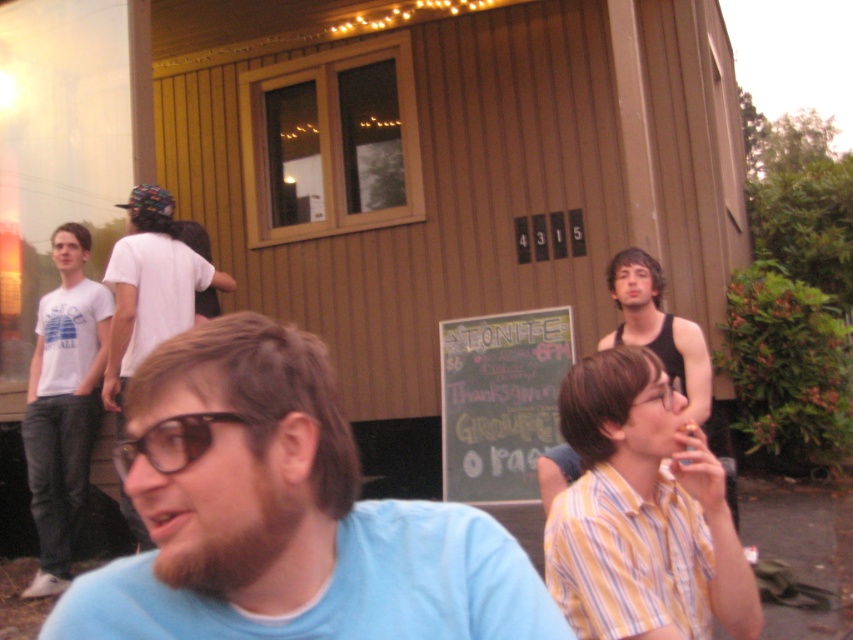
Question: Can you confirm if white matte t-shirt at left is wider than white t-shirt at left?

Choices:
 (A) yes
 (B) no

Answer: (B)

Question: Which point is closer to the camera?

Choices:
 (A) yellow striped shirt at lower right
 (B) white t-shirt at left
 (C) striped cotton shirt at center
 (D) white matte t-shirt at left

Answer: (A)

Question: Which of these objects is positioned closest to the yellow striped shirt at lower right?

Choices:
 (A) white t-shirt at left
 (B) black plastic glasses at center
 (C) white matte t-shirt at left
 (D) striped cotton shirt at center

Answer: (D)

Question: Can you confirm if blue t-shirt at center is thinner than yellow striped shirt at lower right?

Choices:
 (A) no
 (B) yes

Answer: (A)

Question: Which of the following is the closest to the observer?

Choices:
 (A) (160, 241)
 (B) (585, 493)

Answer: (B)

Question: Does blue t-shirt at center have a greater width compared to black plastic glasses at center?

Choices:
 (A) no
 (B) yes

Answer: (B)